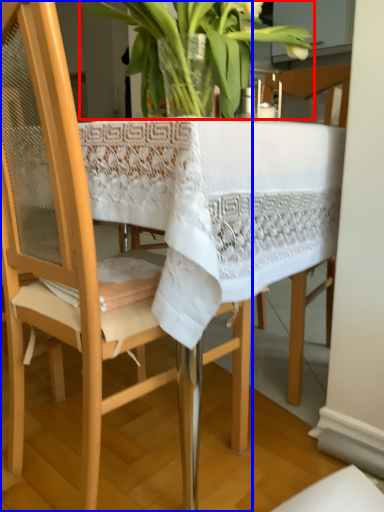
Question: Which object is closer to the camera taking this photo, houseplant (highlighted by a red box) or chair (highlighted by a blue box)?

Choices:
 (A) houseplant
 (B) chair

Answer: (B)